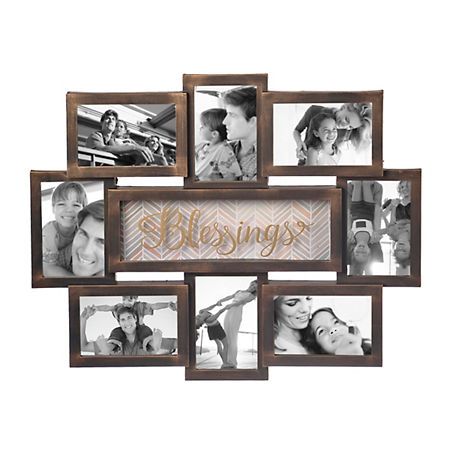
The width and height of the screenshot is (450, 450). What are the coordinates of `bottom section of frame` in the screenshot? It's located at click(227, 269), click(226, 376), click(319, 361), click(137, 363), click(62, 283), click(386, 282), click(333, 170), click(223, 185), click(139, 171).